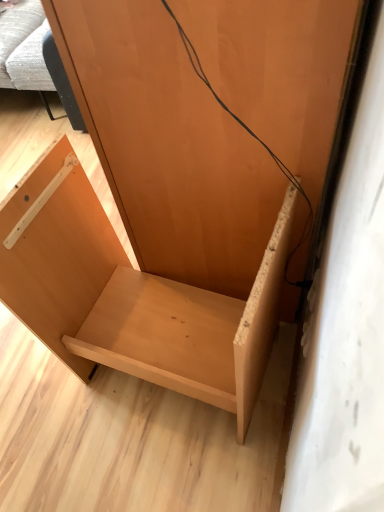
The height and width of the screenshot is (512, 384). I want to click on vacant space to the left of light wood shelf at lower left, so click(x=51, y=415).